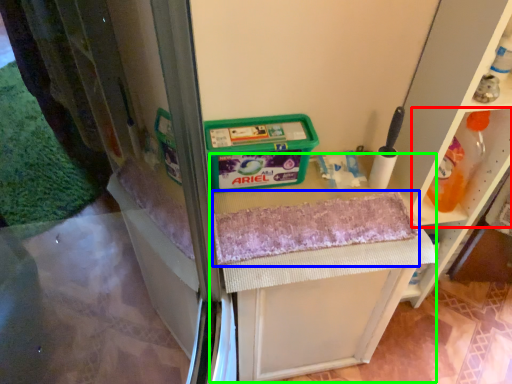
Question: Considering the real-world distances, which object is closest to shelf (highlighted by a red box)? bath towel (highlighted by a blue box) or vanity (highlighted by a green box).

Choices:
 (A) bath towel
 (B) vanity

Answer: (A)